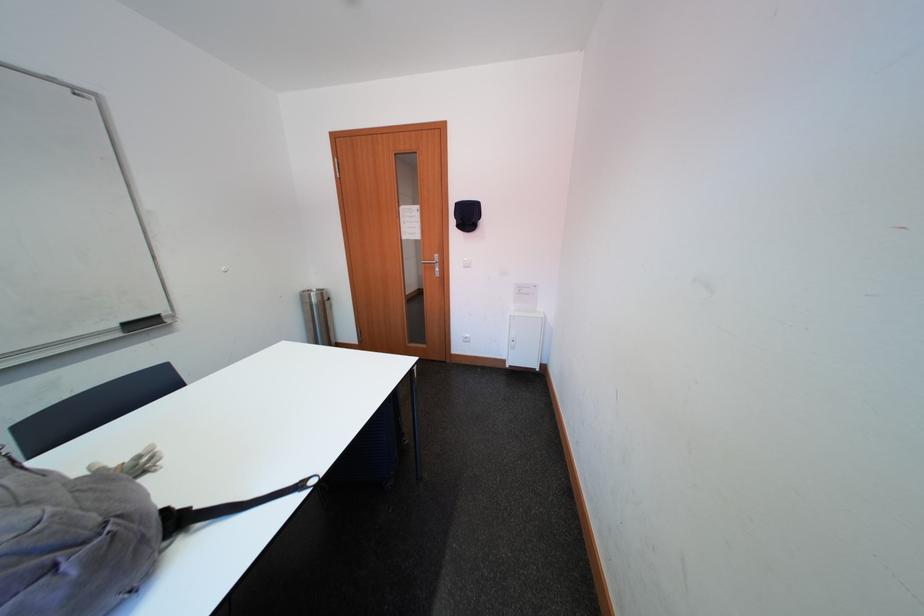
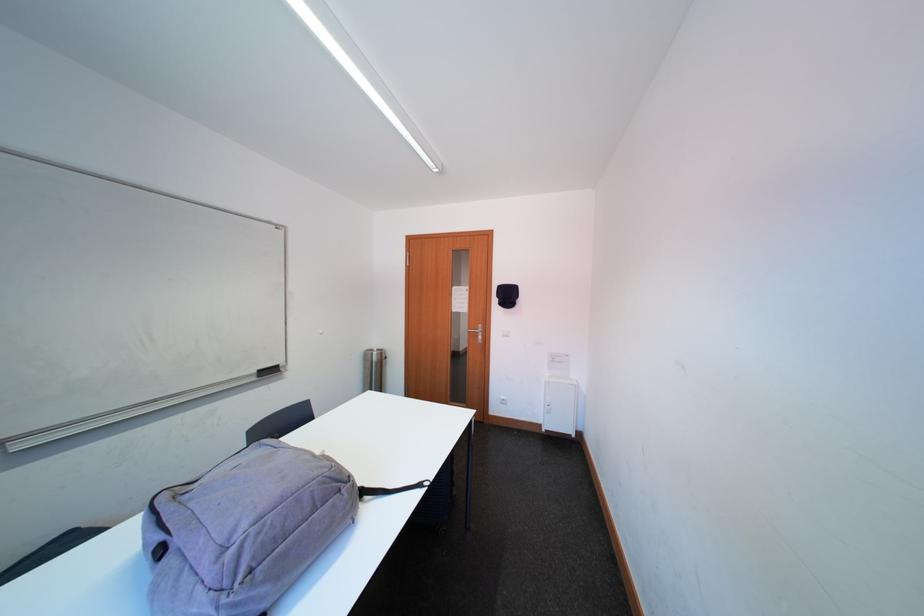
Where in the second image is the point corresponding to point 320,299 from the first image?

(382, 358)